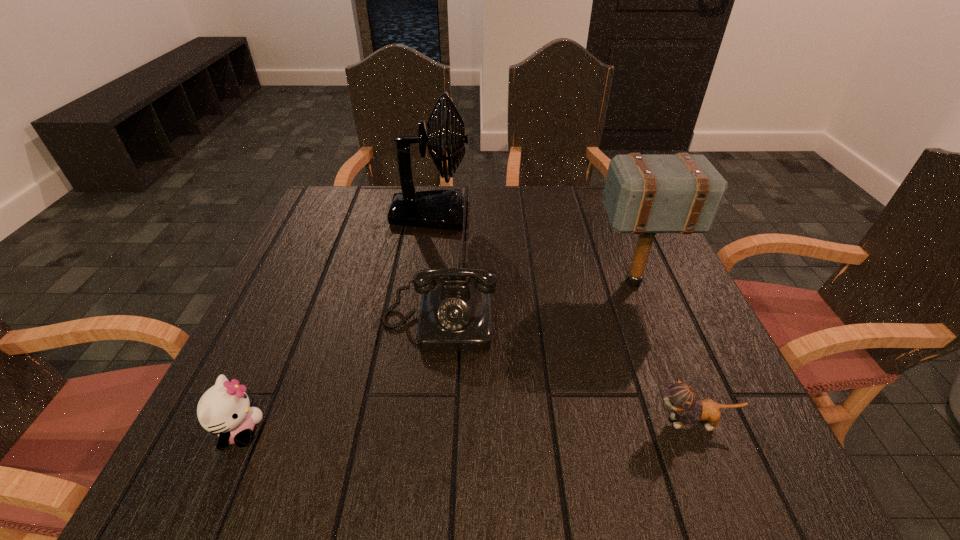
Locate an element on the screen. The image size is (960, 540). free space between the fan and the leftmost object is located at coordinates (335, 322).

Where is `free space between the farthest object and the right kitten`? This screenshot has height=540, width=960. free space between the farthest object and the right kitten is located at coordinates (562, 318).

The image size is (960, 540). Identify the location of free space between the right kitten and the farthest object. (562, 318).

At what (x,y) coordinates should I click in order to perform the action: click on vacant space that is in between the right kitten and the left kitten. Please return your answer as a coordinate pair (x, y). This screenshot has width=960, height=540. Looking at the image, I should click on (467, 427).

This screenshot has height=540, width=960. What are the coordinates of `vacant area that lies between the mallet and the left kitten` in the screenshot? It's located at (437, 356).

Image resolution: width=960 pixels, height=540 pixels. Identify the location of free space between the leftmost object and the farthest object. (335, 322).

Find the location of a particular element. The height and width of the screenshot is (540, 960). empty space between the leftmost object and the telephone is located at coordinates (340, 377).

Identify which object is located as the second nearest to the left kitten. Please provide its 2D coordinates. Your answer should be formatted as a tuple, i.e. [(x, y)], where the tuple contains the x and y coordinates of a point satisfying the conditions above.

[(443, 209)]

Locate which object is the third closest to the leftmost object. Please provide its 2D coordinates. Your answer should be formatted as a tuple, i.e. [(x, y)], where the tuple contains the x and y coordinates of a point satisfying the conditions above.

[(681, 397)]

At what (x,y) coordinates should I click in order to perform the action: click on free region that satisfies the following two spatial constraints: 1. on the dial of the telephone; 2. on the front-facing side of the leftmost object. Please return your answer as a coordinate pair (x, y). This screenshot has width=960, height=540. Looking at the image, I should click on (429, 431).